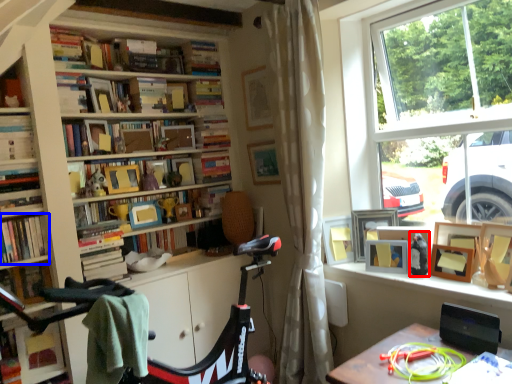
Question: Which object appears closest to the camera in this image, toy (highlighted by a red box) or book (highlighted by a blue box)?

Choices:
 (A) toy
 (B) book

Answer: (B)